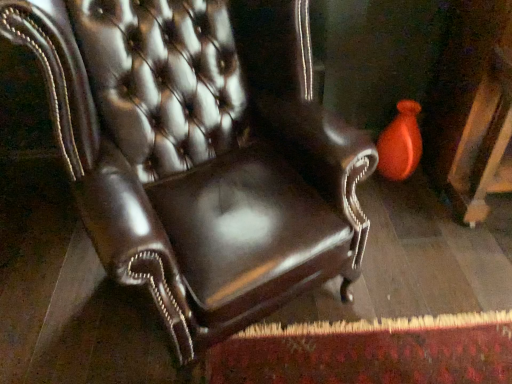
This screenshot has width=512, height=384. Identify the location of free location in front of orange glossy vase at upper right. (403, 206).